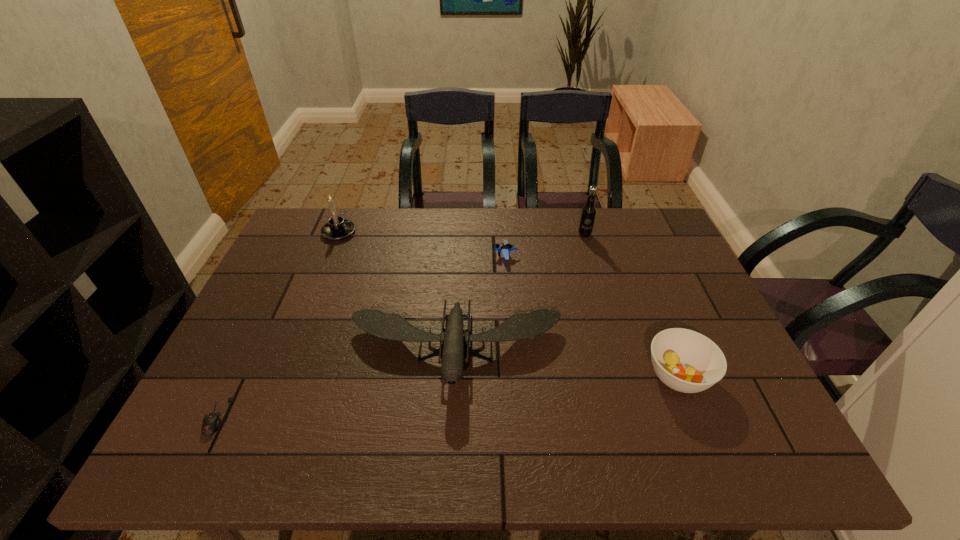
The height and width of the screenshot is (540, 960). I want to click on vacant point located between the drone and the leftmost object, so click(337, 383).

Where is `free space that is in between the drone and the mouse`? The width and height of the screenshot is (960, 540). free space that is in between the drone and the mouse is located at coordinates (337, 383).

Where is `free area in between the second tallest object and the soup bowl`? The height and width of the screenshot is (540, 960). free area in between the second tallest object and the soup bowl is located at coordinates (509, 304).

Select which object is the closest to the drone. Please provide its 2D coordinates. Your answer should be formatted as a tuple, i.e. [(x, y)], where the tuple contains the x and y coordinates of a point satisfying the conditions above.

[(505, 248)]

Point out which object is positioned as the nearest to the root beer. Please provide its 2D coordinates. Your answer should be formatted as a tuple, i.e. [(x, y)], where the tuple contains the x and y coordinates of a point satisfying the conditions above.

[(505, 248)]

Image resolution: width=960 pixels, height=540 pixels. Find the location of `blank area in the image that satisfies the following two spatial constraints: 1. at the head of the soup bowl; 2. on the left side of the fourth shortest object`. blank area in the image that satisfies the following two spatial constraints: 1. at the head of the soup bowl; 2. on the left side of the fourth shortest object is located at coordinates (454, 376).

The image size is (960, 540). Find the location of `blank space that satisfies the following two spatial constraints: 1. on the label of the second object from right to left; 2. on the front-facing side of the third farthest object`. blank space that satisfies the following two spatial constraints: 1. on the label of the second object from right to left; 2. on the front-facing side of the third farthest object is located at coordinates (591, 256).

You are a GUI agent. You are given a task and a screenshot of the screen. Output one action in this format:
    pyautogui.click(x=<x>, y=<y>)
    Task: Click on the vacant space that satisfies the following two spatial constraints: 1. with a handle on the side of the second tallest object; 2. on the front side of the mouse
    This screenshot has width=960, height=540.
    Given the screenshot: What is the action you would take?
    pyautogui.click(x=265, y=416)